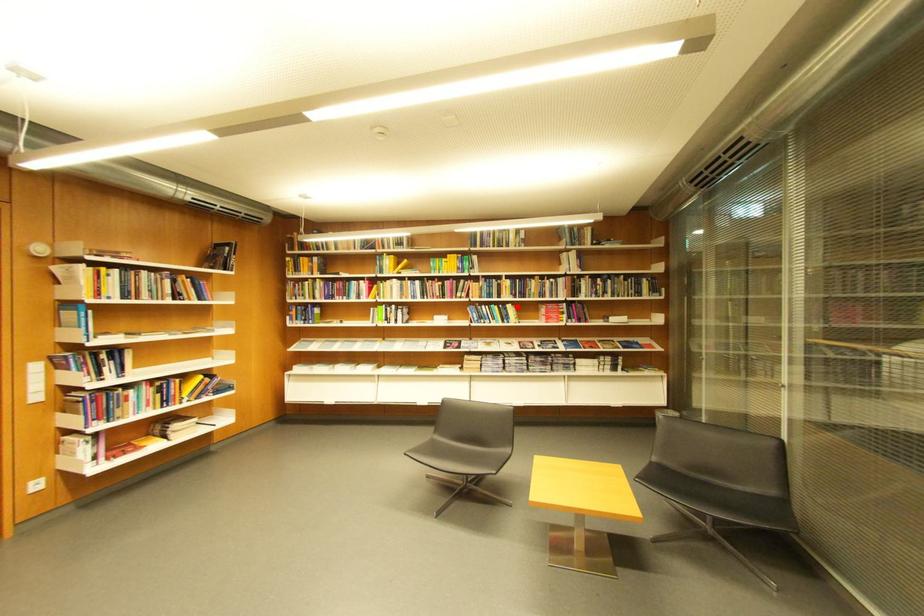
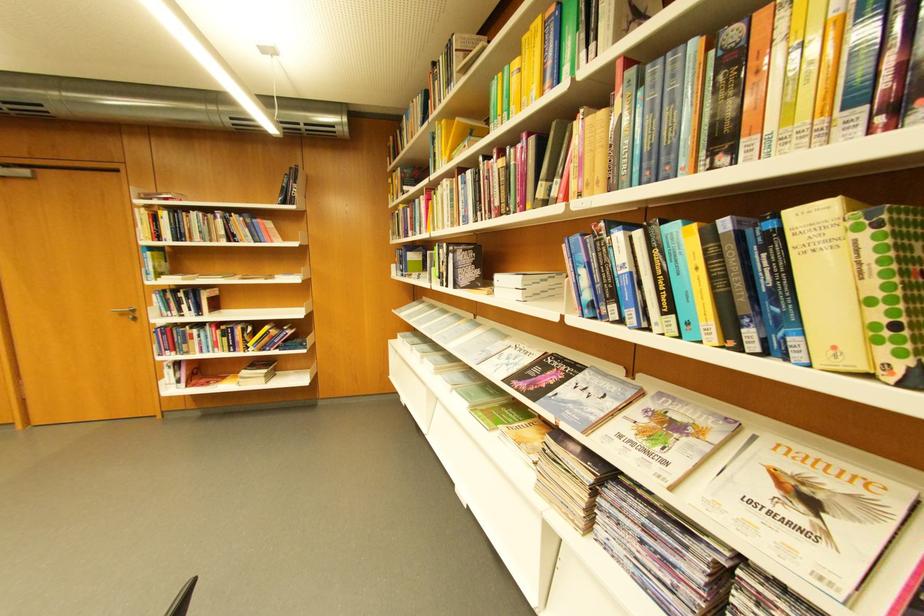
Find the pixel in the second image that matches the highlighted location in the first image.

(796, 214)